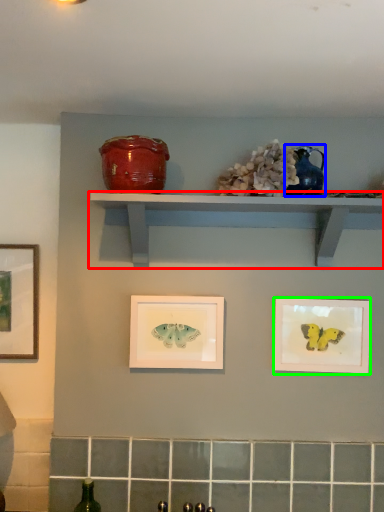
Question: Estimate the real-world distances between objects in this image. Which object is farther from shelf (highlighted by a red box), teal (highlighted by a blue box) or picture frame (highlighted by a green box)?

Choices:
 (A) teal
 (B) picture frame

Answer: (B)